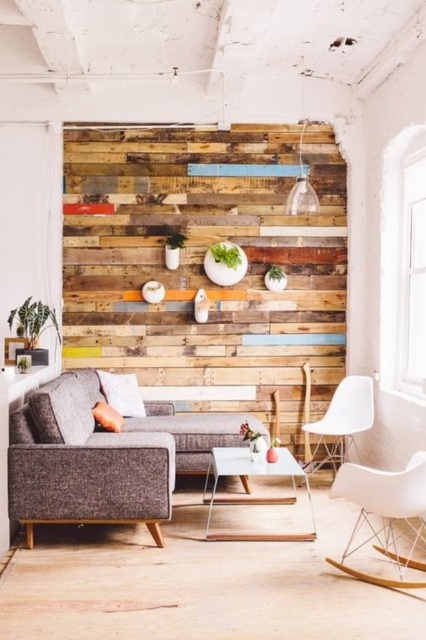
You are standing in the living room and want to move towards the textured gray couch at left. Which direction should you move relative to your current position at point [100,456]?

The textured gray couch at left is represented by point [100,456], so you are already at the location of the textured gray couch at left.